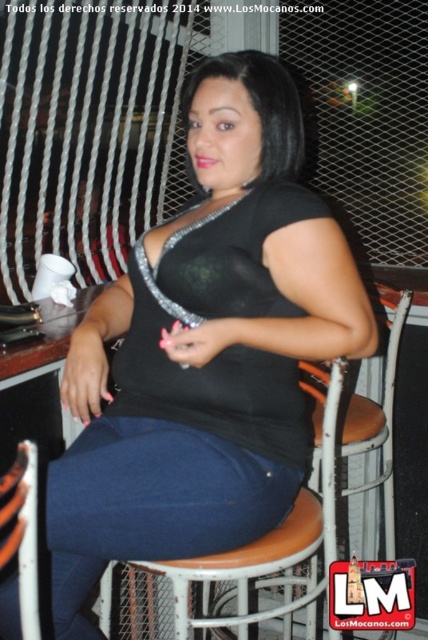
Does point (279, 106) come closer to viewer compared to point (23, 513)?

No.

Who is lower down, black matte dress at center or brown leather chair at lower left?

Positioned lower is brown leather chair at lower left.

Is point (160, 513) positioned behind point (24, 557)?

Yes, it is.

Where is `black matte dress at center`? black matte dress at center is located at coordinates (205, 349).

Who is higher up, orange cushioned stool at center or brown leather chair at lower left?

Positioned higher is brown leather chair at lower left.

Does orange cushioned stool at center appear on the right side of brown leather chair at lower left?

Indeed, orange cushioned stool at center is positioned on the right side of brown leather chair at lower left.

Between point (308, 602) and point (27, 614), which one is positioned behind?

The point (308, 602) is behind.

You are a GUI agent. You are given a task and a screenshot of the screen. Output one action in this format:
    pyautogui.click(x=<x>, y=<y>)
    Task: Click on the orange cushioned stool at center
    The height and width of the screenshot is (640, 428).
    Given the screenshot: What is the action you would take?
    pyautogui.click(x=243, y=564)

Can you confirm if black matte dress at center is thinner than orange cushioned stool at center?

In fact, black matte dress at center might be wider than orange cushioned stool at center.

Does point (86, 566) come behind point (312, 616)?

That is False.

This screenshot has height=640, width=428. Identify the location of black matte dress at center. (205, 349).